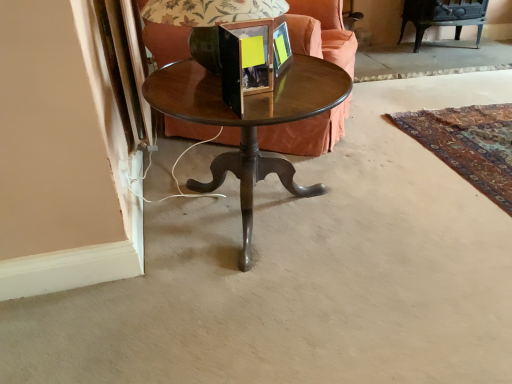
Question: Should I look upward or downward to see matte black picture frame at upper center, the 2th picture frame positioned from the front?

Choices:
 (A) up
 (B) down

Answer: (A)

Question: Can you confirm if wooden picture frame at center, which is the 1th picture frame in front-to-back order, is smaller than matte black picture frame at upper center, the 2th picture frame positioned from the front?

Choices:
 (A) yes
 (B) no

Answer: (B)

Question: Is wooden picture frame at center, which is the 1th picture frame in front-to-back order, at the left side of matte black picture frame at upper center, marked as the first picture frame in a back-to-front arrangement?

Choices:
 (A) no
 (B) yes

Answer: (B)

Question: Is wooden picture frame at center, which is the 1th picture frame in front-to-back order, not inside matte black picture frame at upper center, the 2th picture frame positioned from the front?

Choices:
 (A) no
 (B) yes

Answer: (B)

Question: Is wooden picture frame at center, which is the 1th picture frame in front-to-back order, not close to matte black picture frame at upper center, the 2th picture frame positioned from the front?

Choices:
 (A) no
 (B) yes

Answer: (A)

Question: From the image's perspective, does wooden picture frame at center, arranged as the 2th picture frame when viewed from the back, appear higher than matte black picture frame at upper center, the 2th picture frame positioned from the front?

Choices:
 (A) no
 (B) yes

Answer: (A)

Question: Is wooden picture frame at center, which is the 1th picture frame in front-to-back order, oriented towards matte black picture frame at upper center, the 2th picture frame positioned from the front?

Choices:
 (A) no
 (B) yes

Answer: (A)

Question: Is velvet orange couch at center touching wooden picture frame at center, arranged as the 2th picture frame when viewed from the back?

Choices:
 (A) yes
 (B) no

Answer: (B)

Question: Are velvet orange couch at center and wooden picture frame at center, which is the 1th picture frame in front-to-back order, located far from each other?

Choices:
 (A) no
 (B) yes

Answer: (A)

Question: From a real-world perspective, is velvet orange couch at center over wooden picture frame at center, which is the 1th picture frame in front-to-back order?

Choices:
 (A) no
 (B) yes

Answer: (A)

Question: Is velvet orange couch at center facing away from wooden picture frame at center, which is the 1th picture frame in front-to-back order?

Choices:
 (A) no
 (B) yes

Answer: (A)

Question: Can you confirm if velvet orange couch at center is positioned to the left of wooden picture frame at center, arranged as the 2th picture frame when viewed from the back?

Choices:
 (A) no
 (B) yes

Answer: (A)

Question: Is the depth of velvet orange couch at center less than that of wooden picture frame at center, arranged as the 2th picture frame when viewed from the back?

Choices:
 (A) no
 (B) yes

Answer: (A)

Question: From the image's perspective, is wooden round table at center above matte black lampshade at center?

Choices:
 (A) no
 (B) yes

Answer: (A)